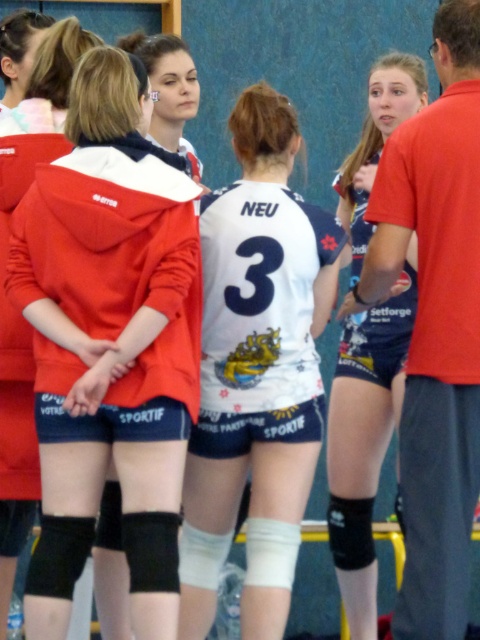
You are a sports equipment manager preparing to store the team uniforms. You have a storage locker that can only accommodate items up to the size of the blue jersey shorts at center. Can the white jersey at center fit into this locker?

The white jersey at center has a larger size compared to the blue jersey shorts at center. Therefore, the white jersey at center cannot fit into the locker designed for the blue jersey shorts at center.

You are a photographer setting up for a volleyball team photo in a sports hall. You need to ensure that the white jersey at center and the blue jersey shorts at center are both visible in the shot. Based on their positions, which one is higher up in the frame?

The white jersey at center is located above the blue jersey shorts at center, so it is higher up in the frame.

You are a photographer positioned at the entrance of the sports hall. You need to take a photo that includes both the matte red hoodie at center and the blue jersey shorts at center. Based on their positions, which object should you adjust your camera angle to focus on first to ensure both are in frame?

The matte red hoodie at center is to the left of the blue jersey shorts at center. To capture both in the frame, adjust your camera to focus on the matte red hoodie at center first, then ensure the blue jersey shorts at center is visible to the right of it.